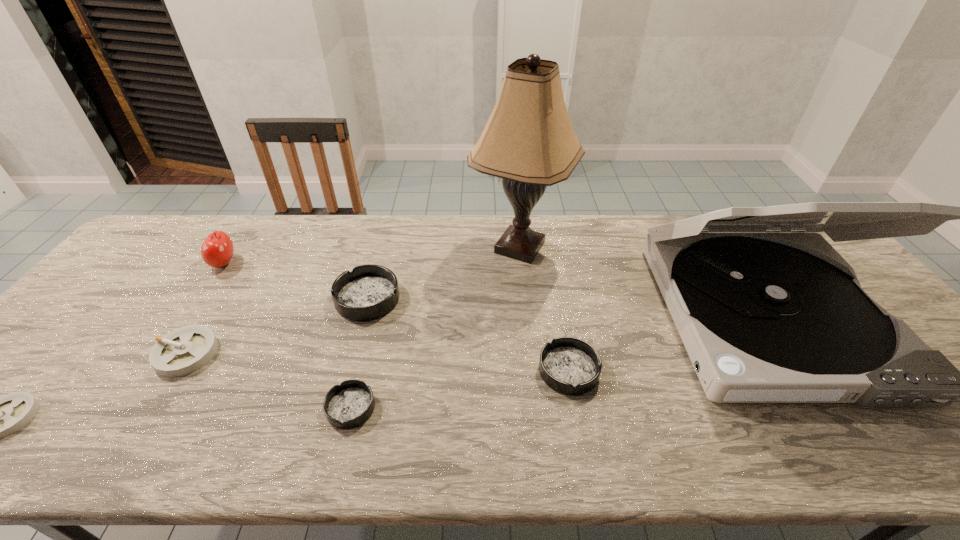
The width and height of the screenshot is (960, 540). Find the location of `beige lamp`. beige lamp is located at coordinates (528, 141).

Find the location of a particular element. This screenshot has height=540, width=960. the tallest object is located at coordinates (528, 141).

Identify the location of the rightmost object. (767, 315).

Identify the location of the second tallest object. (767, 315).

Find the location of a particular element. The width and height of the screenshot is (960, 540). apple is located at coordinates (217, 250).

This screenshot has width=960, height=540. Find the location of `the farthest ashtray`. the farthest ashtray is located at coordinates (368, 292).

What are the coordinates of `the farthest dark ashtray` in the screenshot? It's located at (368, 292).

Find the location of a particular element. The image size is (960, 540). the rightmost dark ashtray is located at coordinates (571, 366).

This screenshot has height=540, width=960. Find the location of `the rightmost ashtray`. the rightmost ashtray is located at coordinates (571, 366).

Where is `the right gray ashtray`? the right gray ashtray is located at coordinates (185, 350).